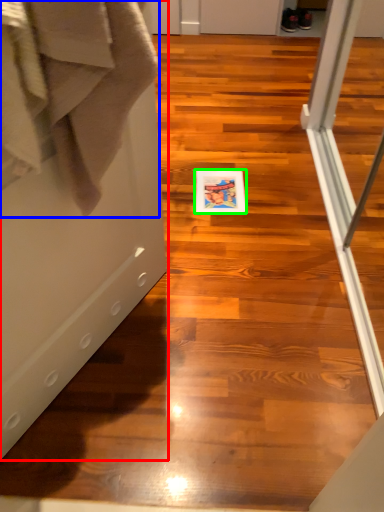
Question: Based on their relative distances, which object is farther from screen door (highlighted by a red box)? Choose from bath towel (highlighted by a blue box) and postcard (highlighted by a green box).

Choices:
 (A) bath towel
 (B) postcard

Answer: (B)